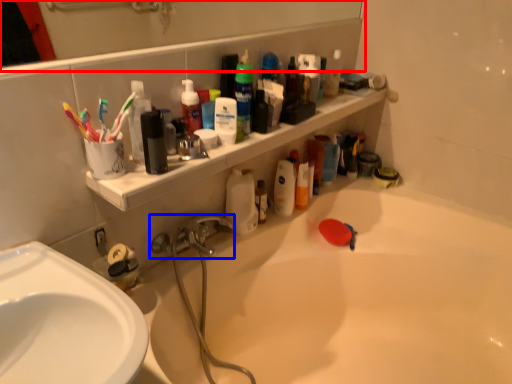
Question: Which object appears closest to the camera in this image, mirror (highlighted by a red box) or tap (highlighted by a blue box)?

Choices:
 (A) mirror
 (B) tap

Answer: (A)